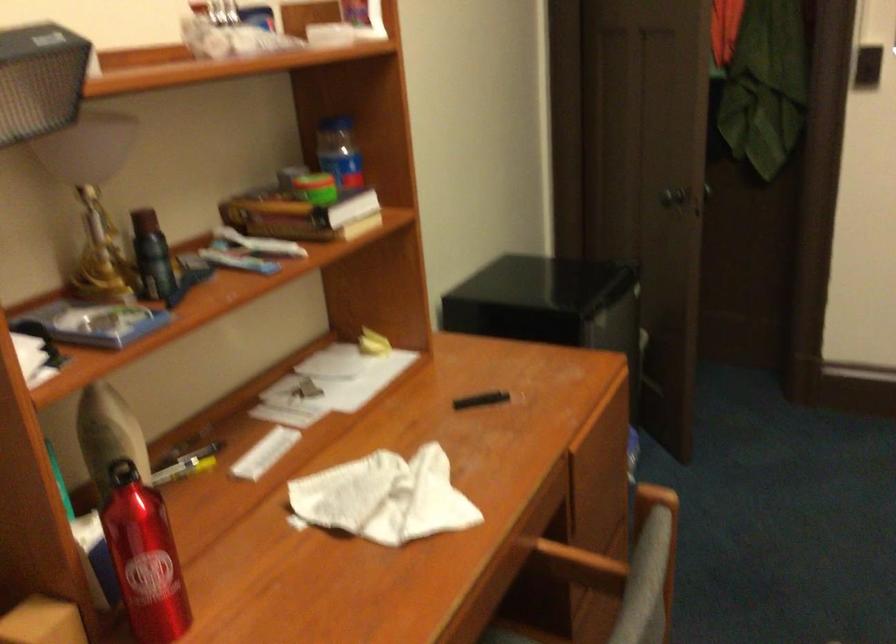
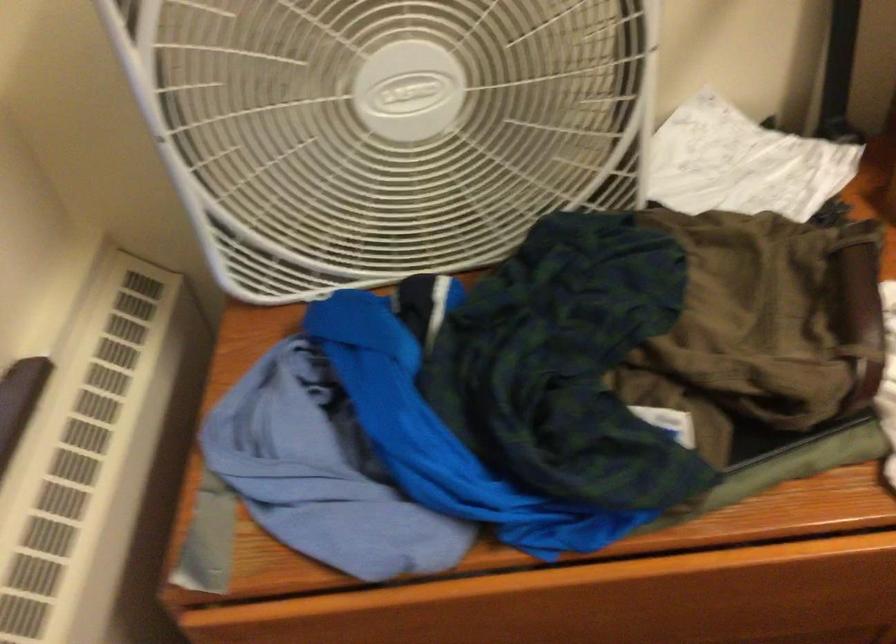
Consider the image. How did the camera likely rotate?

The camera rotated toward left-down.